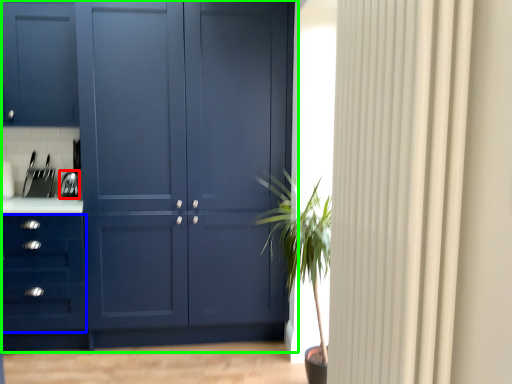
Question: Which object is the farthest from appliance (highlighted by a red box)? Choose among these: drawer (highlighted by a blue box) or cupboard (highlighted by a green box).

Choices:
 (A) drawer
 (B) cupboard

Answer: (B)